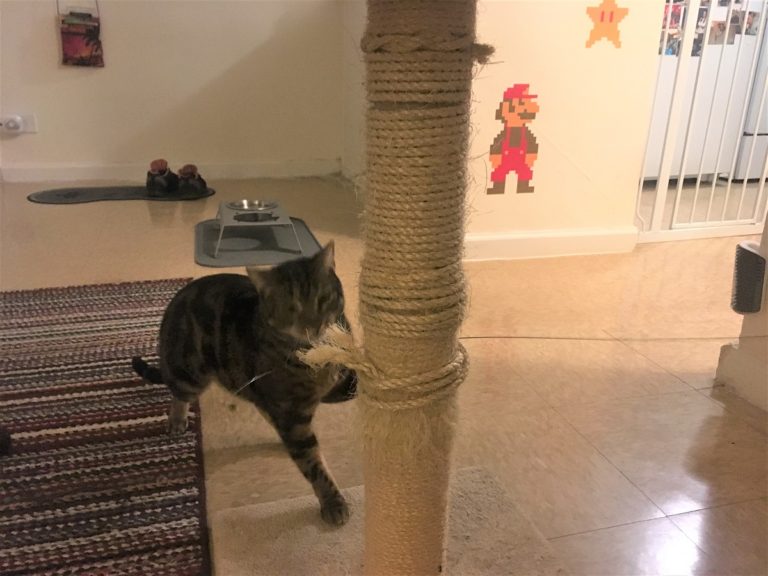
This screenshot has height=576, width=768. In order to click on pictures in this screenshot , I will do `click(750, 22)`, `click(716, 32)`, `click(700, 13)`, `click(700, 35)`, `click(673, 14)`, `click(669, 49)`.